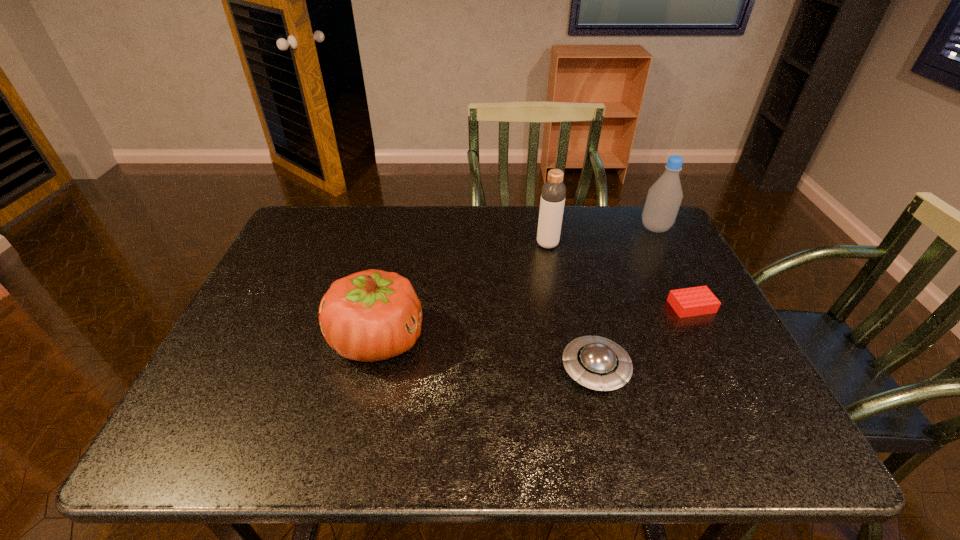
Where is `free space between the fourth nearest object and the pumpkin`? free space between the fourth nearest object and the pumpkin is located at coordinates (463, 292).

This screenshot has height=540, width=960. In order to click on unoccupied area between the fourth tallest object and the left bottle in this screenshot , I will do [x=571, y=307].

Where is `vacant space that's between the second shortest object and the right bottle`? The height and width of the screenshot is (540, 960). vacant space that's between the second shortest object and the right bottle is located at coordinates (625, 299).

This screenshot has height=540, width=960. In order to click on the fourth closest object relative to the fourth nearest object in this screenshot , I will do `click(372, 315)`.

Select which object is the second closest to the fourth nearest object. Please provide its 2D coordinates. Your answer should be formatted as a tuple, i.e. [(x, y)], where the tuple contains the x and y coordinates of a point satisfying the conditions above.

[(694, 301)]

Where is `vacant region that satisfies the following two spatial constraints: 1. on the back side of the farther bottle; 2. on the left side of the Lego`? This screenshot has width=960, height=540. vacant region that satisfies the following two spatial constraints: 1. on the back side of the farther bottle; 2. on the left side of the Lego is located at coordinates (651, 228).

The height and width of the screenshot is (540, 960). In order to click on free space that satisfies the following two spatial constraints: 1. on the front side of the farthest object; 2. on the side of the pumpkin with the cute face in this screenshot , I will do `click(713, 339)`.